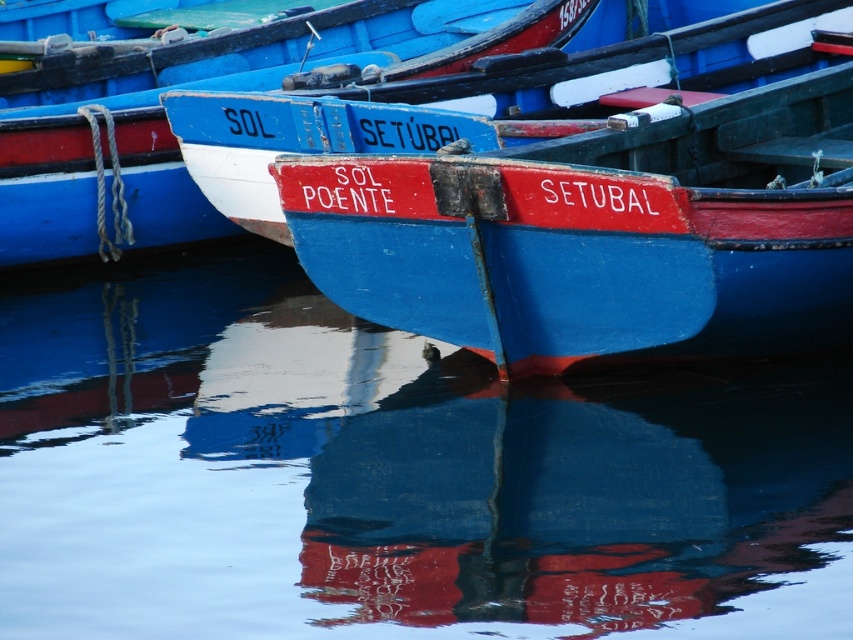
Question: Observing the image, what is the correct spatial positioning of glossy blue water at center in reference to matte blue boat at center?

Choices:
 (A) above
 (B) below

Answer: (B)

Question: Which object is farther from the camera taking this photo?

Choices:
 (A) blue wooden boat at center
 (B) glossy blue water at center

Answer: (A)

Question: Does blue wooden boat at center have a lesser width compared to matte blue boat at center?

Choices:
 (A) no
 (B) yes

Answer: (A)

Question: Which of the following is the closest to the observer?

Choices:
 (A) blue wooden boat at center
 (B) glossy blue water at center

Answer: (B)

Question: Does glossy blue water at center appear under blue wooden boat at center?

Choices:
 (A) yes
 (B) no

Answer: (A)

Question: Which point is closer to the camera?

Choices:
 (A) (508, 1)
 (B) (410, 112)

Answer: (B)